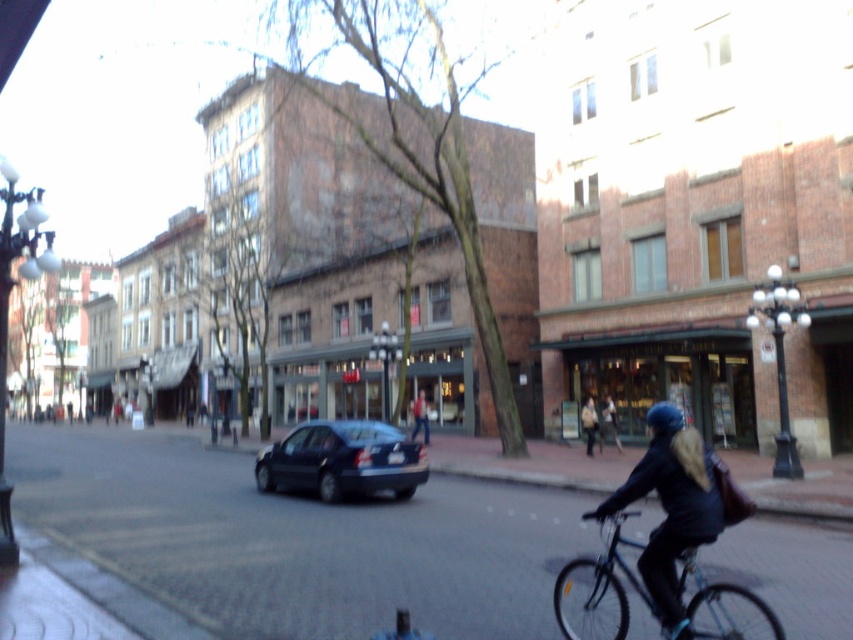
You are a pedestrian standing at the crosswalk and see the shiny dark blue sedan at center and the dark blue jacket at center. Which one is closer to you?

The shiny dark blue sedan at center is closer to you because it is in front of the dark blue jacket at center.

You are a pedestrian standing at the crosswalk and see a cyclist wearing a dark blue jacket at center and a dark blue helmet at center. Which item is closer to you?

The dark blue helmet at center is closer to you because it is in front of the dark blue jacket at center.